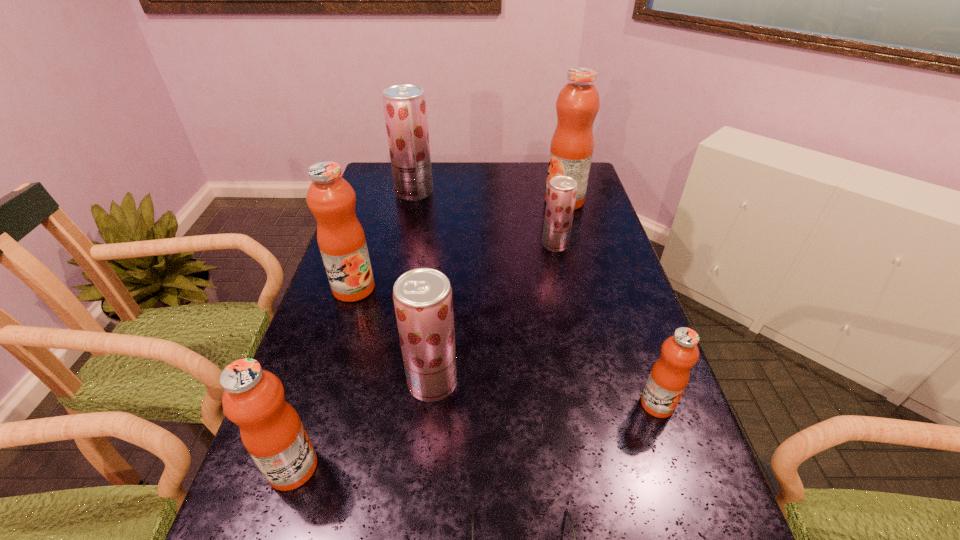
The width and height of the screenshot is (960, 540). Identify the location of unoccupied position between the leftmost strawberry fruit juice and the smallest strawberry fruit juice. (485, 219).

Find the location of a particular element. free space between the farthest strawberry fruit juice and the tallest object is located at coordinates (490, 197).

This screenshot has height=540, width=960. Identify the location of object that stands as the second closest to the farthest strawberry fruit juice. (571, 149).

Identify which object is the nearest to the leftmost strawberry fruit juice. Please provide its 2D coordinates. Your answer should be formatted as a tuple, i.e. [(x, y)], where the tuple contains the x and y coordinates of a point satisfying the conditions above.

[(331, 199)]

Identify which fruit juice is located as the sixth nearest to the tallest object. Please provide its 2D coordinates. Your answer should be formatted as a tuple, i.e. [(x, y)], where the tuple contains the x and y coordinates of a point satisfying the conditions above.

[(271, 431)]

In order to click on fruit juice that is the third closest to the nearest fruit juice in this screenshot , I will do `click(669, 376)`.

Point out which orange fruit juice is positioned as the second nearest to the nearest fruit juice. Please provide its 2D coordinates. Your answer should be formatted as a tuple, i.e. [(x, y)], where the tuple contains the x and y coordinates of a point satisfying the conditions above.

[(669, 376)]

At what (x,y) coordinates should I click in order to perform the action: click on orange fruit juice that is the fourth nearest to the sixth nearest object. Please return your answer as a coordinate pair (x, y). This screenshot has width=960, height=540. Looking at the image, I should click on (271, 431).

The width and height of the screenshot is (960, 540). Identify the location of strawberry fruit juice that can be found as the second closest to the fifth nearest object. (405, 110).

Point out which strawberry fruit juice is positioned as the second nearest to the second strawberry fruit juice from right to left. Please provide its 2D coordinates. Your answer should be formatted as a tuple, i.e. [(x, y)], where the tuple contains the x and y coordinates of a point satisfying the conditions above.

[(405, 110)]